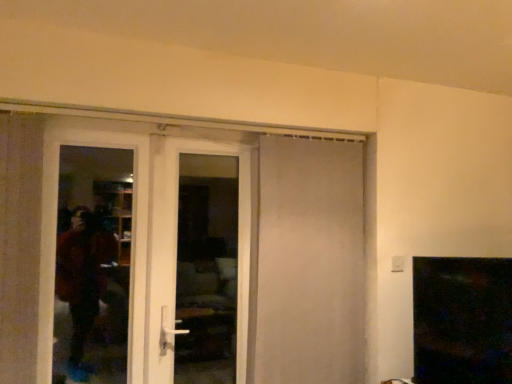
Question: Is white glossy door at left, marked as the 3th door in a right-to-left arrangement, facing towards white matte door at center, acting as the 1th door starting from the right?

Choices:
 (A) no
 (B) yes

Answer: (A)

Question: From the image's perspective, does white glossy door at left, marked as the 3th door in a right-to-left arrangement, appear higher than white matte door at center, which appears as the third door when viewed from the left?

Choices:
 (A) yes
 (B) no

Answer: (B)

Question: Is white glossy door at left, marked as the 3th door in a right-to-left arrangement, closer to the viewer compared to white matte door at center, acting as the 1th door starting from the right?

Choices:
 (A) no
 (B) yes

Answer: (B)

Question: Is white glossy door at left, placed as the first door when sorted from left to right, bigger than white matte door at center, acting as the 1th door starting from the right?

Choices:
 (A) yes
 (B) no

Answer: (B)

Question: From a real-world perspective, is white glossy door at left, marked as the 3th door in a right-to-left arrangement, on top of white matte door at center, which appears as the third door when viewed from the left?

Choices:
 (A) no
 (B) yes

Answer: (A)

Question: Is white matte door at center, which appears as the third door when viewed from the left, taller or shorter than transparent glass screen door at left?

Choices:
 (A) tall
 (B) short

Answer: (A)

Question: Looking at their shapes, would you say white matte door at center, acting as the 1th door starting from the right, is wider or thinner than transparent glass screen door at left?

Choices:
 (A) thin
 (B) wide

Answer: (B)

Question: In the image, is white matte door at center, acting as the 1th door starting from the right, on the left side or the right side of transparent glass screen door at left?

Choices:
 (A) left
 (B) right

Answer: (B)

Question: Considering the positions of point (289, 167) and point (113, 147), is point (289, 167) closer or farther from the camera than point (113, 147)?

Choices:
 (A) closer
 (B) farther

Answer: (B)

Question: Is point click(x=334, y=261) closer or farther from the camera than point click(x=243, y=352)?

Choices:
 (A) farther
 (B) closer

Answer: (A)

Question: In terms of width, does white matte door at center, acting as the 1th door starting from the right, look wider or thinner when compared to white glossy door at center, acting as the second door starting from the left?

Choices:
 (A) thin
 (B) wide

Answer: (A)

Question: From the image's perspective, relative to white glossy door at center, acting as the second door starting from the left, is white matte door at center, acting as the 1th door starting from the right, above or below?

Choices:
 (A) above
 (B) below

Answer: (B)

Question: Would you say white matte door at center, which appears as the third door when viewed from the left, is inside or outside white glossy door at center, acting as the second door starting from the left?

Choices:
 (A) inside
 (B) outside

Answer: (B)

Question: From a real-world perspective, is white matte door at center, which appears as the third door when viewed from the left, positioned above or below white glossy door at left, placed as the first door when sorted from left to right?

Choices:
 (A) below
 (B) above

Answer: (B)

Question: From the image's perspective, is white matte door at center, acting as the 1th door starting from the right, located above or below white glossy door at left, marked as the 3th door in a right-to-left arrangement?

Choices:
 (A) above
 (B) below

Answer: (A)